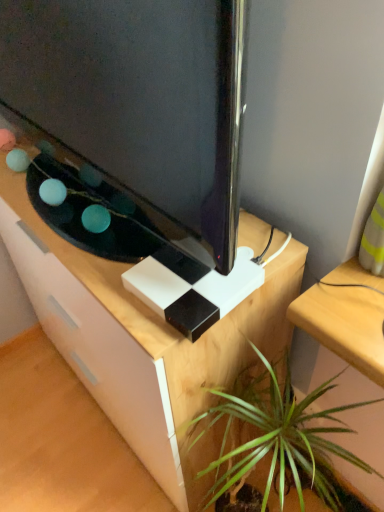
Question: Is green leafy plant at lower center taller or shorter than white matte desk at center?

Choices:
 (A) tall
 (B) short

Answer: (B)

Question: In terms of size, does green leafy plant at lower center appear bigger or smaller than white matte desk at center?

Choices:
 (A) small
 (B) big

Answer: (A)

Question: Estimate the real-world distances between objects in this image. Which object is farther from the matte black tv at center?

Choices:
 (A) white matte desk at center
 (B) green leafy plant at lower center

Answer: (B)

Question: Considering the real-world distances, which object is closest to the white matte desk at center?

Choices:
 (A) matte black tv at center
 (B) green leafy plant at lower center

Answer: (B)